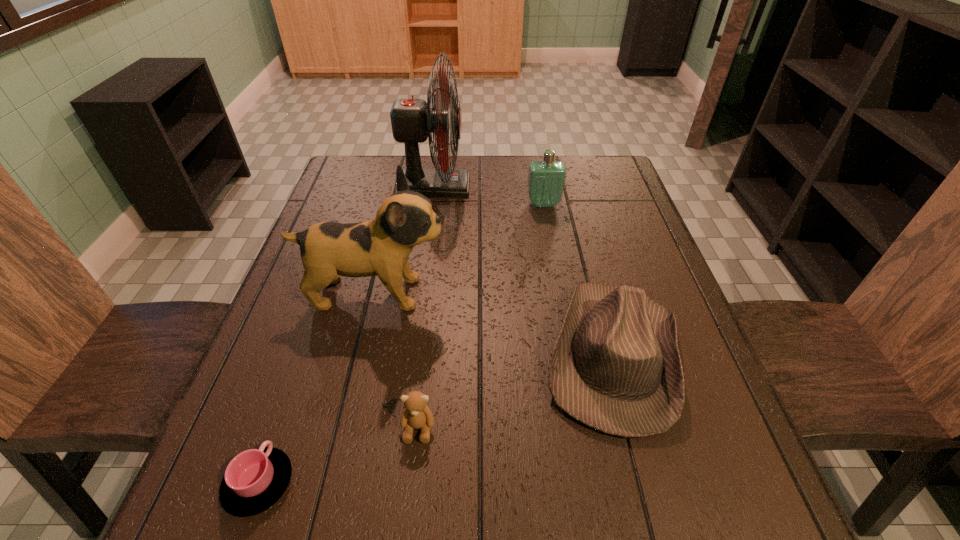
At what (x,y) coordinates should I click in order to perform the action: click on vacant space situated 0.310m on the back of the fedora. Please return your answer as a coordinate pair (x, y). The height and width of the screenshot is (540, 960). Looking at the image, I should click on (575, 211).

I want to click on free space located on the side with the handle of the cup, so click(x=287, y=402).

Locate an element on the screen. vacant space situated on the side with the handle of the cup is located at coordinates (324, 299).

This screenshot has width=960, height=540. In order to click on vacant area situated on the side with the handle of the cup in this screenshot , I will do `click(319, 312)`.

The height and width of the screenshot is (540, 960). I want to click on object at the far edge, so click(x=413, y=121).

Find the location of a particular element. The height and width of the screenshot is (540, 960). object that is positioned at the near edge is located at coordinates (254, 480).

This screenshot has height=540, width=960. Find the location of `puppy situated at the left edge`. puppy situated at the left edge is located at coordinates (381, 246).

Where is `cup that is at the left edge`? Image resolution: width=960 pixels, height=540 pixels. cup that is at the left edge is located at coordinates (254, 480).

The height and width of the screenshot is (540, 960). Identify the location of object that is at the right edge. (616, 367).

Find the location of a particular element. The height and width of the screenshot is (540, 960). object that is at the near left corner is located at coordinates (254, 480).